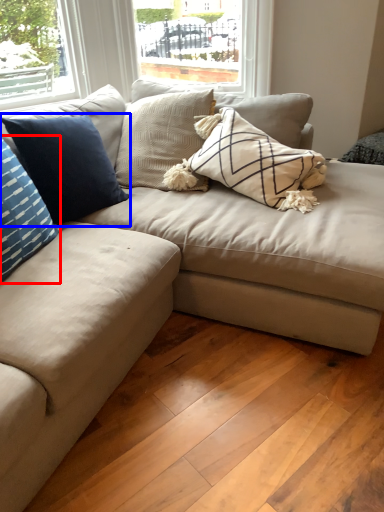
Question: Among these objects, which one is farthest to the camera, pillow (highlighted by a red box) or pillow (highlighted by a blue box)?

Choices:
 (A) pillow
 (B) pillow

Answer: (B)